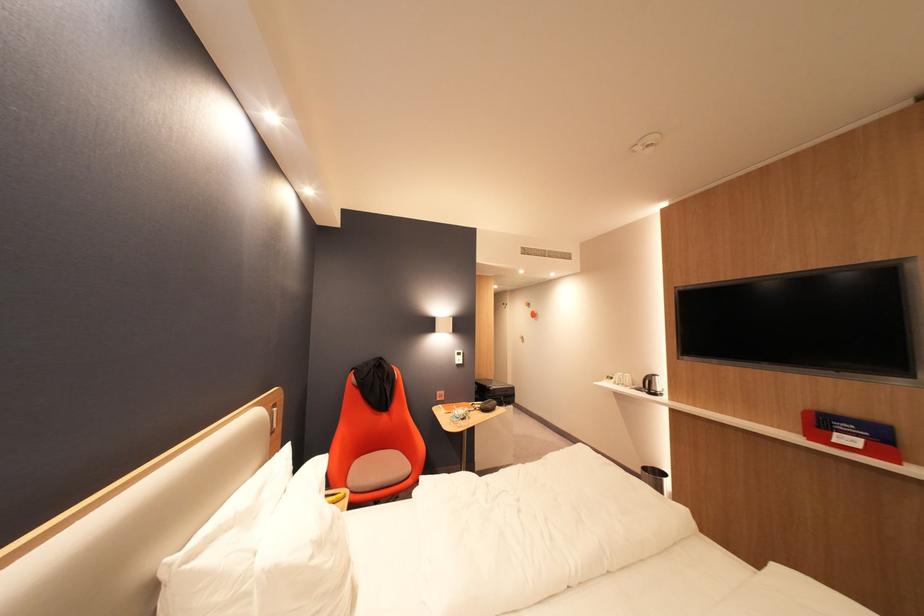
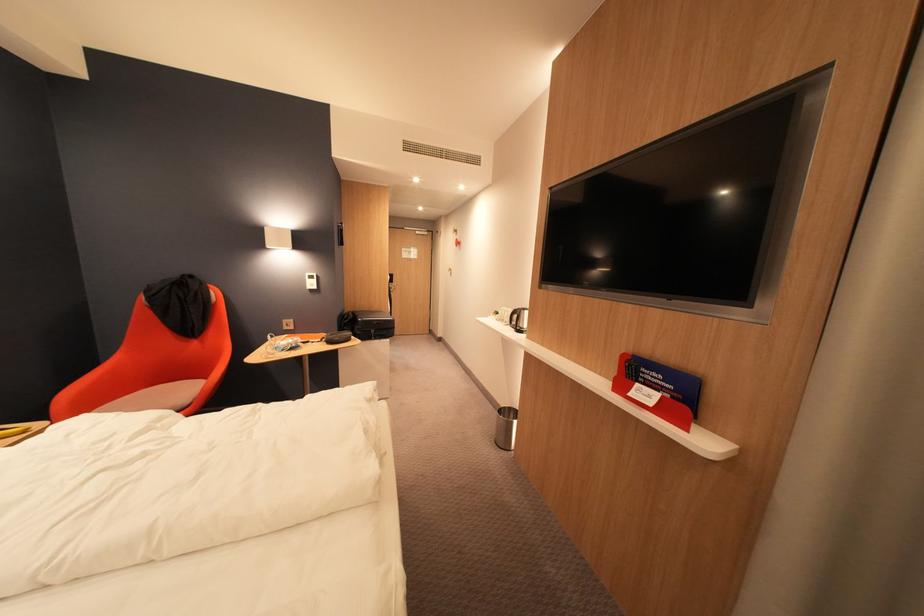
In the second image, find the point that corresponds to pixel 638 376 in the first image.

(519, 310)